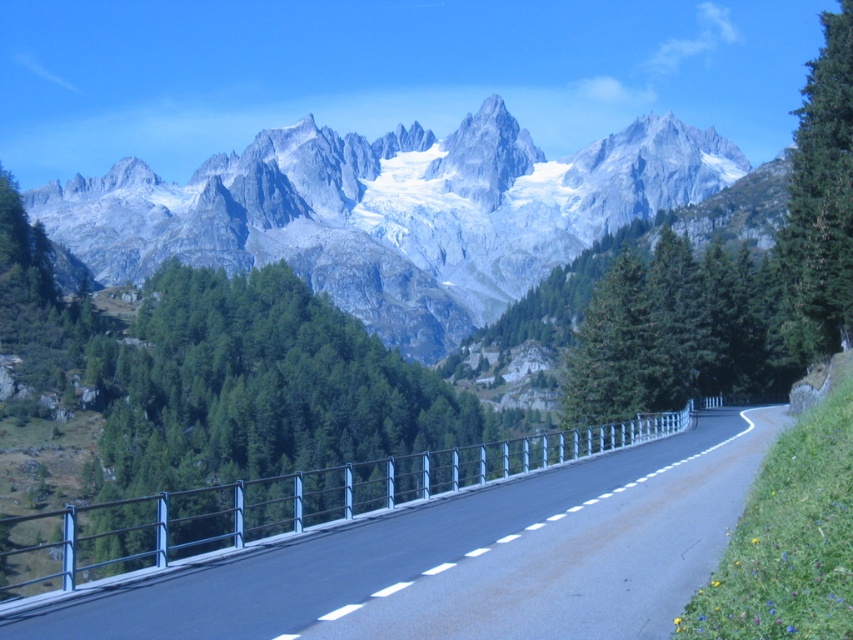
Find the location of a particular element. gray rocky mountain range at upper center is located at coordinates (390, 212).

Can you confirm if gray rocky mountain range at upper center is positioned to the left of green matte tree at right?

Correct, you'll find gray rocky mountain range at upper center to the left of green matte tree at right.

Between point (120, 221) and point (836, 241), which one is positioned behind?

The point (120, 221) is behind.

Identify the location of gray rocky mountain range at upper center. The image size is (853, 640). (390, 212).

Does point (258, 406) come in front of point (787, 278)?

No.

What are the coordinates of `green leafy trees at center` in the screenshot? It's located at (258, 387).

Does gray rocky mountain range at upper center have a smaller size compared to black asphalt road at center?

No, gray rocky mountain range at upper center is not smaller than black asphalt road at center.

Can you confirm if gray rocky mountain range at upper center is taller than black asphalt road at center?

Yes, gray rocky mountain range at upper center is taller than black asphalt road at center.

Locate an element on the screen. Image resolution: width=853 pixels, height=640 pixels. gray rocky mountain range at upper center is located at coordinates (390, 212).